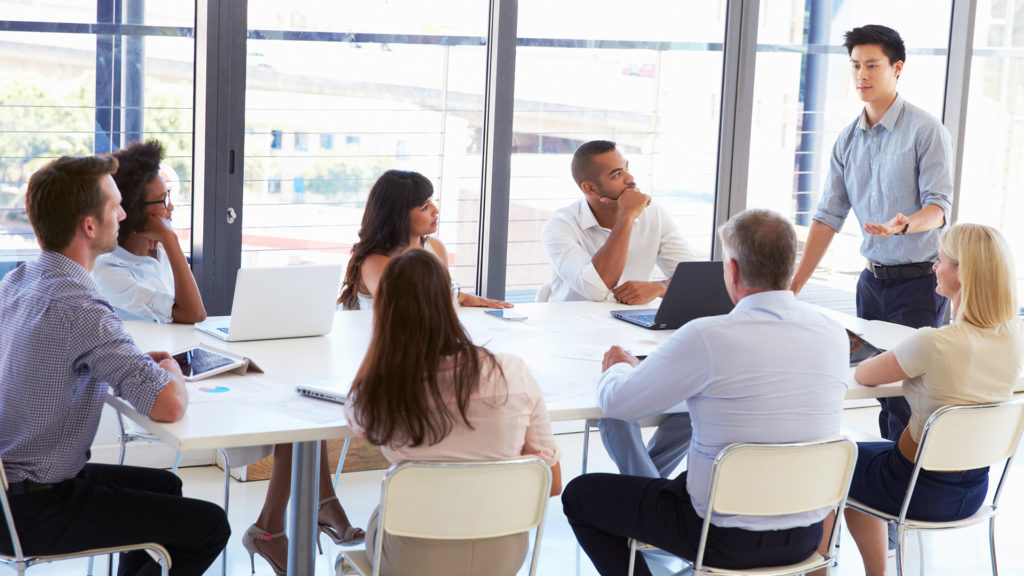
In order to click on chairs in this screenshot , I will do [x=443, y=487], [x=759, y=469], [x=956, y=439], [x=16, y=562], [x=133, y=433].